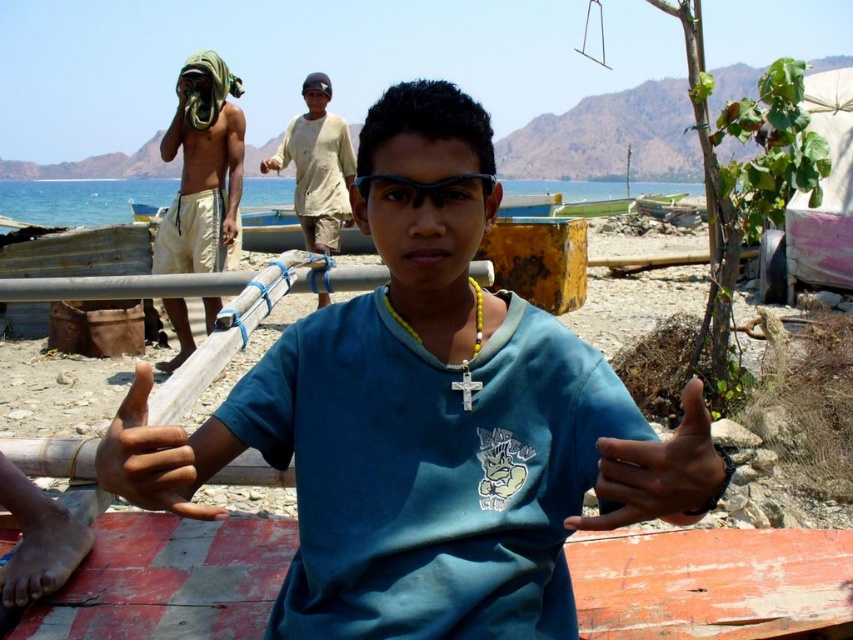
Question: Which of the following is the closest to the observer?

Choices:
 (A) blue cotton shirt at center
 (B) dark skin hand at center

Answer: (B)

Question: Among these objects, which one is nearest to the camera?

Choices:
 (A) blue cotton shirt at center
 (B) brown leather hand at center

Answer: (A)

Question: Does beige striped shorts at upper left have a smaller size compared to dark skin hand at center?

Choices:
 (A) yes
 (B) no

Answer: (B)

Question: Which of the following is the closest to the observer?

Choices:
 (A) light beige cotton shirt at center
 (B) brown leather hand at center
 (C) dark skin hand at center

Answer: (C)

Question: Can you confirm if dark skin hand at center is positioned below brown leather hand at center?

Choices:
 (A) yes
 (B) no

Answer: (B)

Question: Does dark skin hand at center have a smaller size compared to light beige cotton shirt at center?

Choices:
 (A) yes
 (B) no

Answer: (A)